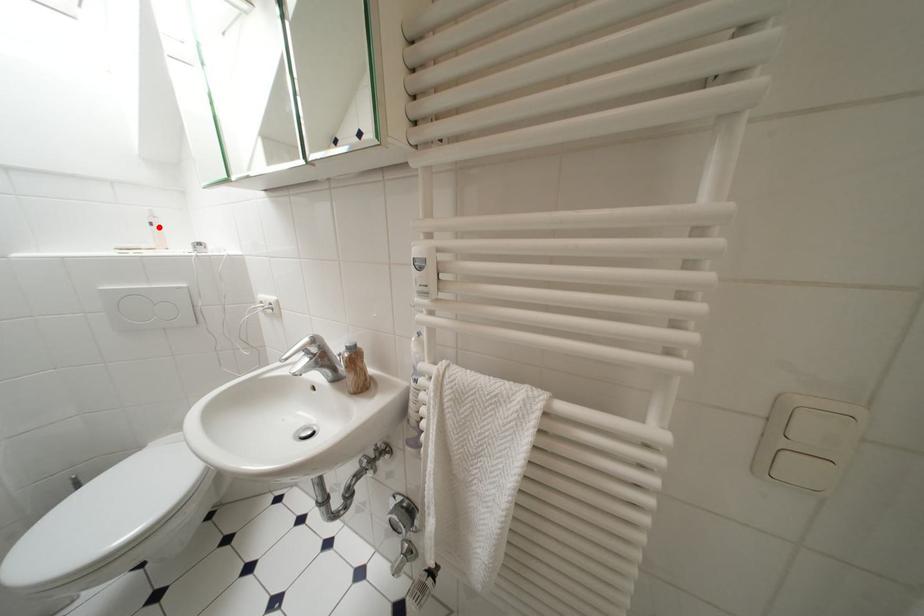
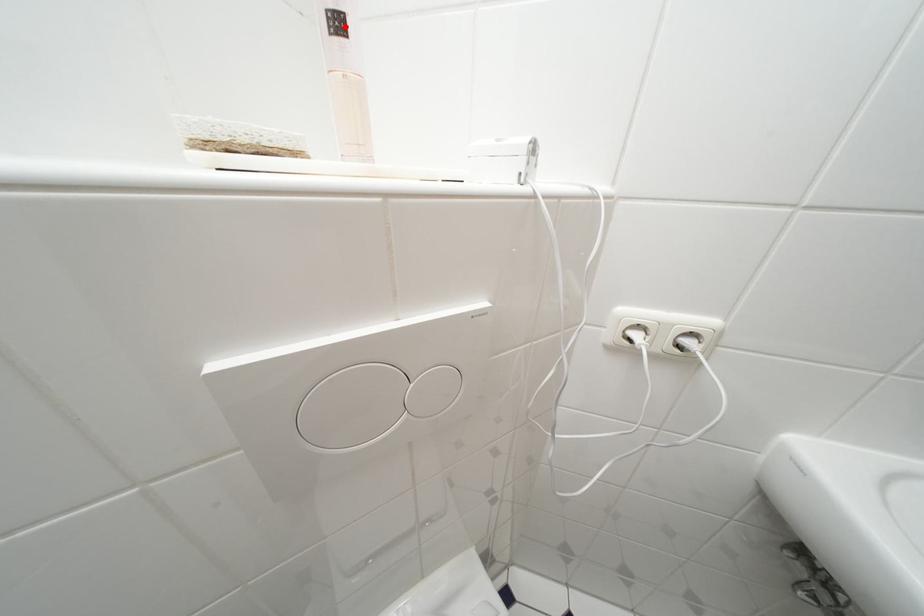
I am providing you with two images of the same scene from different viewpoints. A red point is marked on the first image and another point is marked on the second image. Does the point marked in image1 correspond to the same location as the one in image2?

Yes